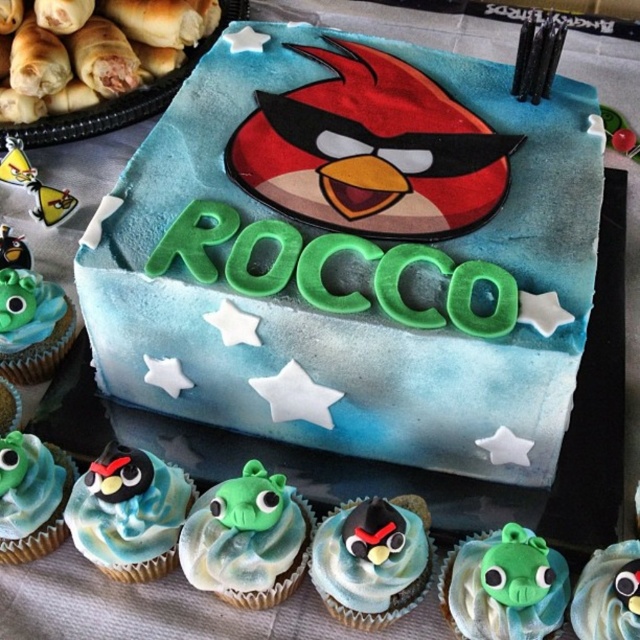
Is matte black tray at upper left behind matte green fondant angry bird at lower right?

Yes, it is behind matte green fondant angry bird at lower right.

Is matte black tray at upper left closer to camera compared to matte green fondant angry bird at lower right?

No, matte black tray at upper left is behind matte green fondant angry bird at lower right.

Is point (67, 125) behind point (595, 563)?

Yes, point (67, 125) is farther from viewer.

You are a GUI agent. You are given a task and a screenshot of the screen. Output one action in this format:
    pyautogui.click(x=<x>, y=<y>)
    Task: Click on the matte black tray at upper left
    
    Given the screenshot: What is the action you would take?
    [122, 99]

Which is behind, point (148, 253) or point (540, 548)?

Point (148, 253)

Does point (506, 240) come closer to viewer compared to point (547, 570)?

No, (506, 240) is behind (547, 570).

At what (x,y) coordinates should I click in order to perform the action: click on blue fondant cake at center. Please return your answer as a coordinate pair (x, y). The height and width of the screenshot is (640, 640). Looking at the image, I should click on (353, 253).

Find the location of `green fondant angry bird at center`. green fondant angry bird at center is located at coordinates (248, 538).